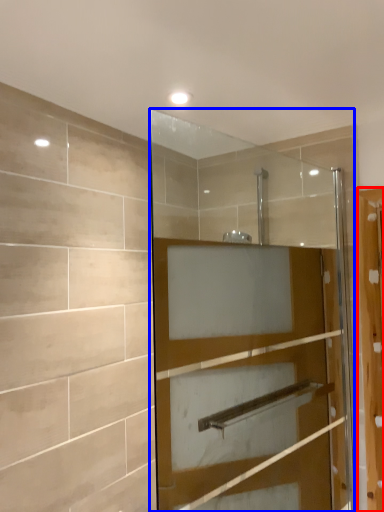
Question: Which object appears closest to the camera in this image, screen door (highlighted by a red box) or door (highlighted by a blue box)?

Choices:
 (A) screen door
 (B) door

Answer: (B)